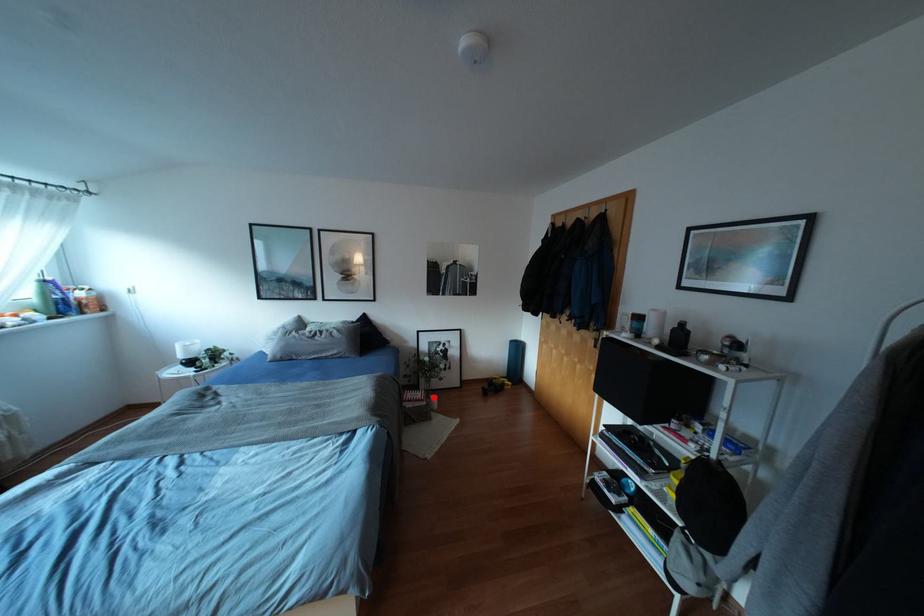
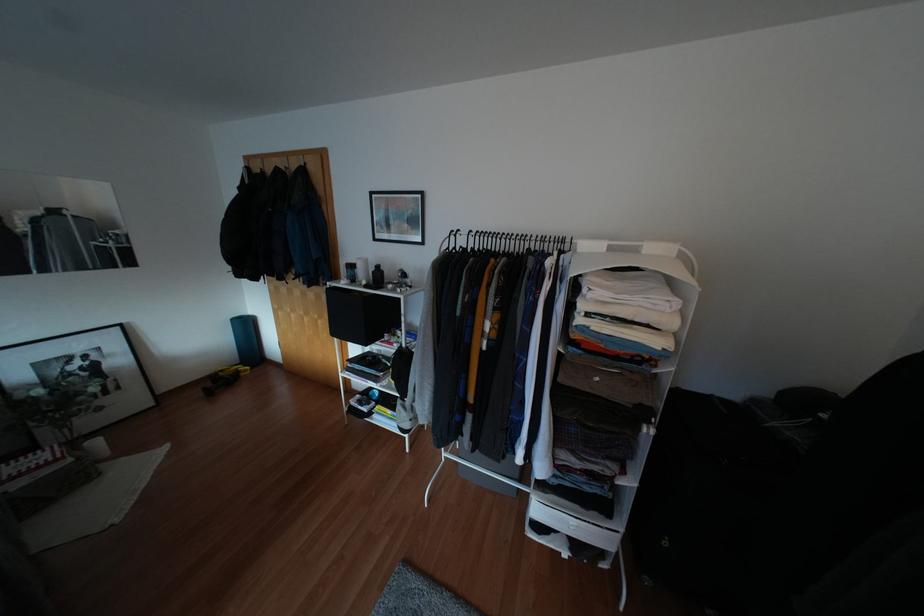
Question: I am providing you with two images of the same scene from different viewpoints. Image1 has a red point marked. In image2, the corresponding 3D location appears at what relative position? Reply with the corresponding letter.

Choices:
 (A) Closer
 (B) Farther

Answer: (A)